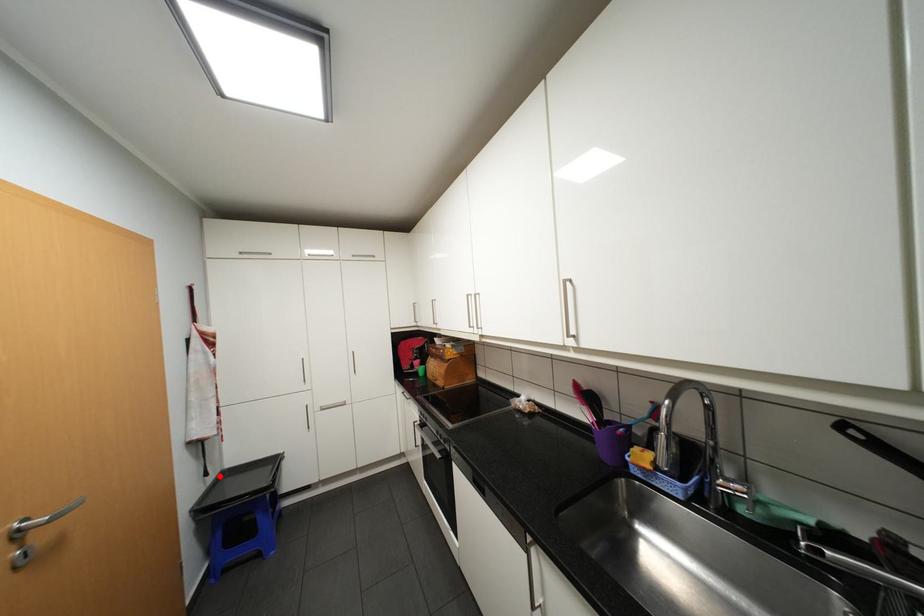
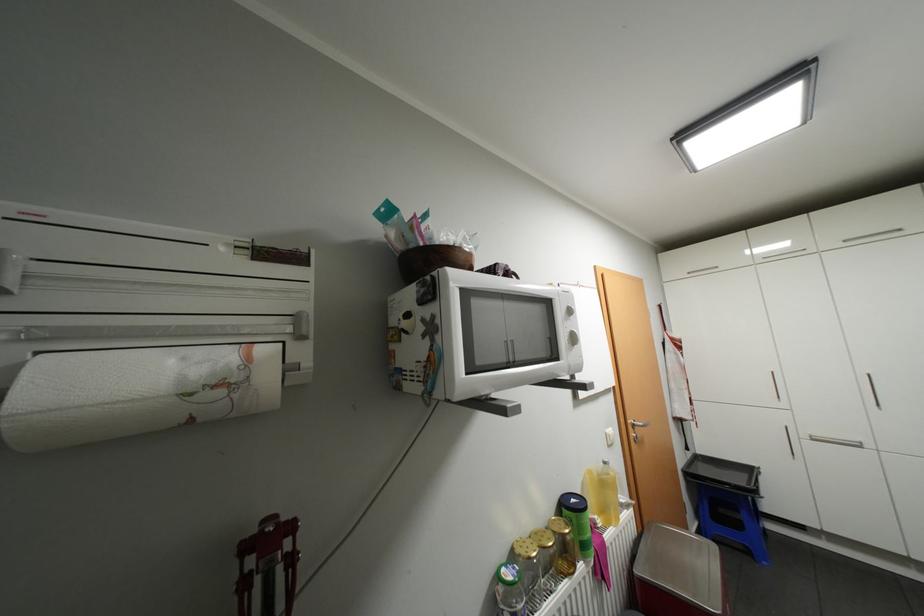
Question: A red point is marked in image1. In image2, is the corresponding 3D point closer to the camera or farther? Reply with the corresponding letter.

Choices:
 (A) The corresponding 3D point is closer.
 (B) The corresponding 3D point is farther.

Answer: (B)